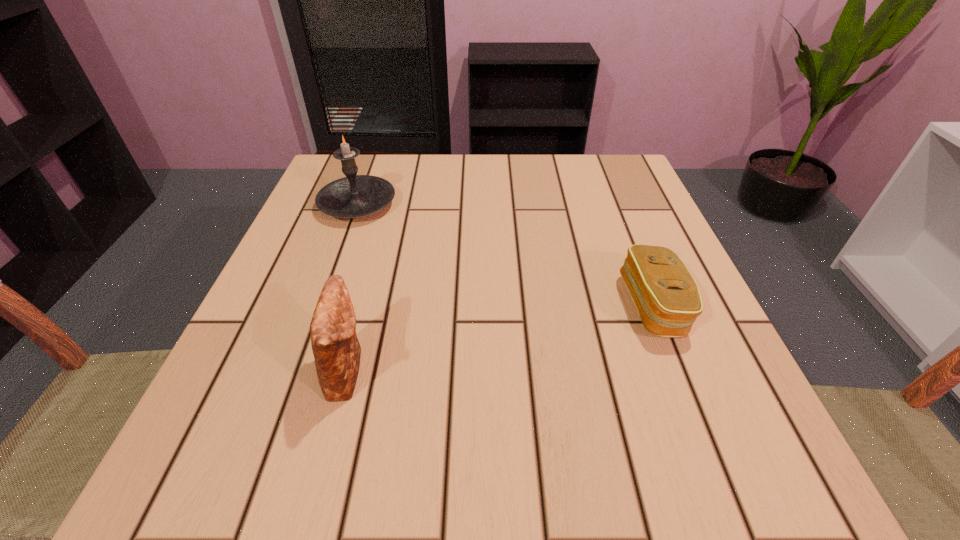
In the image, there is a desktop. Identify the location of free space at the far right corner. This screenshot has height=540, width=960. (620, 162).

The image size is (960, 540). What are the coordinates of `vacant area that lies between the right clutch bag and the second shortest object` in the screenshot? It's located at (500, 338).

Locate an element on the screen. Image resolution: width=960 pixels, height=540 pixels. unoccupied position between the rightmost object and the left clutch bag is located at coordinates (500, 338).

Locate an element on the screen. This screenshot has width=960, height=540. vacant region between the farthest object and the taller clutch bag is located at coordinates (352, 287).

Locate an element on the screen. The height and width of the screenshot is (540, 960). free point between the taller clutch bag and the rightmost object is located at coordinates (500, 338).

The image size is (960, 540). I want to click on blank region between the candle and the shortest object, so click(x=505, y=255).

Locate an element on the screen. Image resolution: width=960 pixels, height=540 pixels. unoccupied position between the candle and the second shortest object is located at coordinates (352, 287).

You are a GUI agent. You are given a task and a screenshot of the screen. Output one action in this format:
    pyautogui.click(x=<x>, y=<y>)
    Task: Click on the blank region between the right clutch bag and the second shortest object
    The height and width of the screenshot is (540, 960).
    Given the screenshot: What is the action you would take?
    pyautogui.click(x=500, y=338)

At what (x,y) coordinates should I click in order to perform the action: click on free point between the farthest object and the left clutch bag. Please return your answer as a coordinate pair (x, y). The image size is (960, 540). Looking at the image, I should click on 352,287.

The image size is (960, 540). In order to click on unoccupied area between the left clutch bag and the rightmost object in this screenshot , I will do `click(500, 338)`.